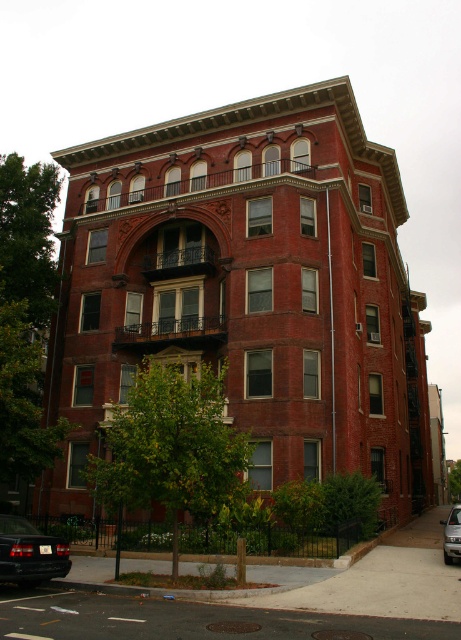
You are a delivery person trying to park your truck between the matte black car at lower left and the satin silver car at lower right. Your truck is 6 meters long. Can you fit your truck in the space between them?

The matte black car at lower left is smaller than the satin silver car at lower right, but the distance between them isn t specified. Without knowing the exact space between the two cars, it s impossible to determine if the truck will fit.

You are a delivery person trying to park your truck between the matte black car at lower left and the satin silver car at lower right. According to the scene, can you fit your truck there?

The matte black car at lower left is above the satin silver car at lower right, so there is no space between them for the truck to park.

You are a delivery person needing to park your vehicle in front of the multi story brick building. You have two cars available, a matte black car at lower left and a satin silver car at lower right. Which car is closer to the entrance of the building?

The matte black car at lower left is positioned on the left side of the satin silver car at lower right. Since the entrance is typically located near the center of the building, the matte black car at lower left is closer to the entrance.